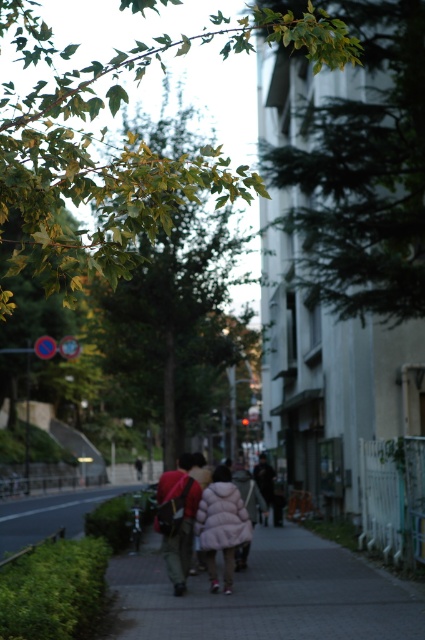
In the scene shown: You are a pedestrian standing on the gray concrete sidewalk at lower left and want to reach the green leafy tree at upper left. Which direction should you move in to get closer to the tree?

To reach the green leafy tree at upper left from the gray concrete sidewalk at lower left, you should move upward since the tree is located above the sidewalk.

You are standing at the point labeled as point (5, 550) and want to walk towards the point labeled as point (374, 150). Given that both points are on the same sidewalk, which direction should you turn to reach your destination?

You should turn towards the direction of point (374, 150) since it is closer to the viewer compared to point (5, 550), meaning it is located ahead in your line of sight.

You are standing on the sidewalk and want to take a photo of both the green leafy branch at upper center and the fluffy pink jacket at center. Which object should you focus on first if you want to ensure both are in focus?

The green leafy branch at upper center is taller than the fluffy pink jacket at center, so focusing on the taller object first would help ensure both are in focus.